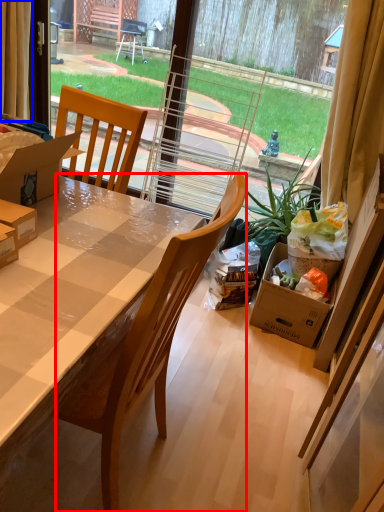
Question: Which object is further to the camera taking this photo, chair (highlighted by a red box) or curtain (highlighted by a blue box)?

Choices:
 (A) chair
 (B) curtain

Answer: (B)